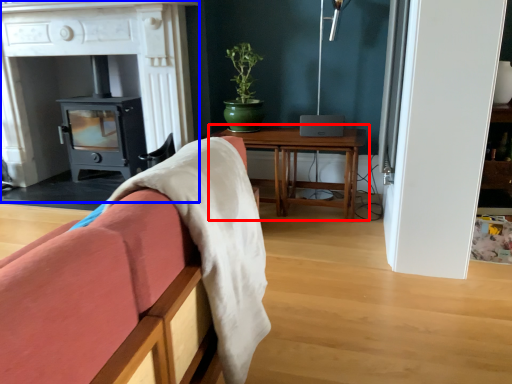
Question: Which object is further to the camera taking this photo, table (highlighted by a red box) or fireplace (highlighted by a blue box)?

Choices:
 (A) table
 (B) fireplace

Answer: (A)